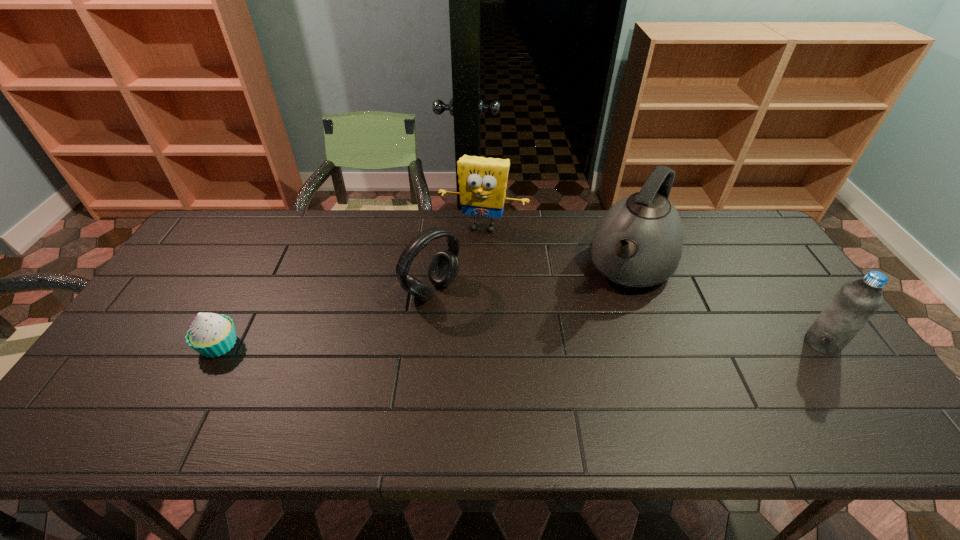
The width and height of the screenshot is (960, 540). I want to click on vacant space located on the earcups of the headset, so click(474, 321).

Identify the location of free spot located on the earcups of the headset. (520, 354).

This screenshot has width=960, height=540. I want to click on vacant space located 0.350m at the spout of the kettle, so click(x=564, y=389).

At what (x,y) coordinates should I click in order to perform the action: click on vacant space located at the spout of the kettle. Please return your answer as a coordinate pair (x, y). Looking at the image, I should click on (597, 334).

At what (x,y) coordinates should I click in order to perform the action: click on vacant space positioned 0.180m at the spout of the kettle. Please return your answer as a coordinate pair (x, y). This screenshot has height=540, width=960. Looking at the image, I should click on (592, 341).

Image resolution: width=960 pixels, height=540 pixels. I want to click on vacant region located 0.090m on the face of the sponge, so point(468,256).

Where is `blank space located on the face of the sponge`? Image resolution: width=960 pixels, height=540 pixels. blank space located on the face of the sponge is located at coordinates (453, 304).

You are a GUI agent. You are given a task and a screenshot of the screen. Output one action in this format:
    pyautogui.click(x=<x>, y=<y>)
    Task: Click on the vacant space located 0.070m on the face of the sponge
    The width and height of the screenshot is (960, 540).
    Given the screenshot: What is the action you would take?
    pyautogui.click(x=470, y=252)

Where is `kettle positioned at the far edge`? This screenshot has width=960, height=540. kettle positioned at the far edge is located at coordinates (638, 243).

Find the location of `sponge located at the far edge`. sponge located at the far edge is located at coordinates (483, 181).